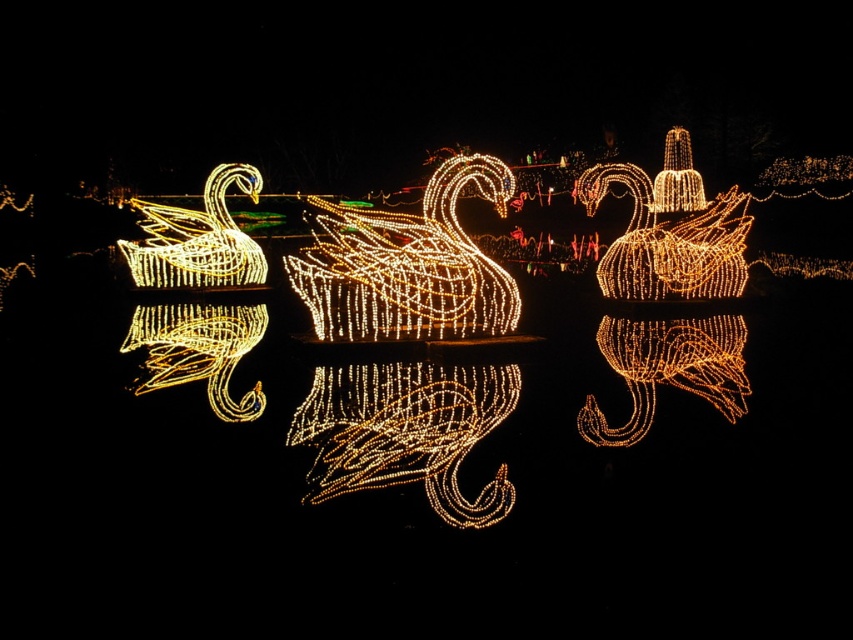
You are a photographer setting up a tripod to capture the illuminated wireframe swans. You want to ensure that both the illuminated wireframe swan at center and the illuminated wireframe swan at left are visible in the frame. Given that your camera has a fixed focal length, which swan should you position closer to the camera to make them appear the same size in the photo?

To make the illuminated wireframe swan at center and the illuminated wireframe swan at left appear the same size in the photo, you should position the illuminated wireframe swan at left closer to the camera. Since the illuminated wireframe swan at center has a greater height compared to the illuminated wireframe swan at left, moving the shorter one forward will balance their apparent sizes.

You are standing on the dock and see both the illuminated wireframe swan at center and the illuminated wireframe swan at left. Which swan is closer to you?

The illuminated wireframe swan at center is closer to you because it is in front of the illuminated wireframe swan at left.

You are standing in front of the illuminated swan sculptures. There are two points marked on the water surface at coordinates point (393, 280) and point (165, 282). Which point is closer to you?

Point (393, 280) is closer to the viewer than point (165, 282).